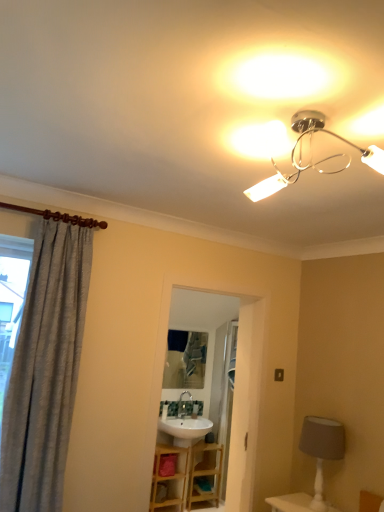
What is the approximate height of white textured table lamp at lower right?

21.40 inches.

You are a GUI agent. You are given a task and a screenshot of the screen. Output one action in this format:
    pyautogui.click(x=<x>, y=<y>)
    Task: Click on the wooden vanity at center
    
    Given the screenshot: What is the action you would take?
    pyautogui.click(x=187, y=474)

In order to face gray textured curtain at left, should I rotate leftwards or rightwards?

Rotate your view left by about 18.788°.

Locate an element on the screen. white textured table lamp at lower right is located at coordinates (322, 449).

Does wooden vanity at center have a greater width compared to gray textured curtain at left?

Indeed, wooden vanity at center has a greater width compared to gray textured curtain at left.

Between wooden vanity at center and gray textured curtain at left, which one has more height?

Standing taller between the two is gray textured curtain at left.

Is wooden vanity at center closer to the viewer compared to gray textured curtain at left?

That is False.

Is wooden vanity at center touching gray textured curtain at left?

No, wooden vanity at center is not touching gray textured curtain at left.

Could you tell me if white textured table lamp at lower right is turned towards gray textured curtain at left?

Yes.

Consider the image. Considering the sizes of objects white textured table lamp at lower right and gray textured curtain at left in the image provided, who is shorter, white textured table lamp at lower right or gray textured curtain at left?

Standing shorter between the two is white textured table lamp at lower right.

Considering the positions of objects white textured table lamp at lower right and gray textured curtain at left in the image provided, who is more to the left, white textured table lamp at lower right or gray textured curtain at left?

gray textured curtain at left is more to the left.

Considering the positions of point (317, 451) and point (17, 428), is point (317, 451) closer or farther from the camera than point (17, 428)?

Point (317, 451).

From a real-world perspective, between metallic reflective mirror at center and wooden vanity at center, who is vertically lower?

wooden vanity at center.

In the scene shown: Considering the sizes of objects metallic reflective mirror at center and wooden vanity at center in the image provided, who is shorter, metallic reflective mirror at center or wooden vanity at center?

wooden vanity at center is shorter.

Between metallic reflective mirror at center and wooden vanity at center, which one has larger size?

wooden vanity at center.

Is the position of metallic reflective mirror at center more distant than that of wooden vanity at center?

Yes, it is.

Based on the photo, can you confirm if wooden vanity at center is thinner than metallic reflective mirror at center?

No.

Considering the relative sizes of wooden vanity at center and metallic reflective mirror at center in the image provided, is wooden vanity at center taller than metallic reflective mirror at center?

No, wooden vanity at center is not taller than metallic reflective mirror at center.

Is wooden vanity at center situated inside metallic reflective mirror at center or outside?

wooden vanity at center cannot be found inside metallic reflective mirror at center.

Is gray textured curtain at left to the left of white textured table lamp at lower right from the viewer's perspective?

Yes, gray textured curtain at left is to the left of white textured table lamp at lower right.

From a real-world perspective, which is physically below, gray textured curtain at left or white textured table lamp at lower right?

white textured table lamp at lower right is physically lower.

Is gray textured curtain at left far away from white textured table lamp at lower right?

gray textured curtain at left is far away from white textured table lamp at lower right.

Choose the correct answer: Is gray textured curtain at left inside wooden vanity at center or outside it?

gray textured curtain at left is not enclosed by wooden vanity at center.

Who is more distant, gray textured curtain at left or wooden vanity at center?

wooden vanity at center.

In terms of size, does gray textured curtain at left appear bigger or smaller than wooden vanity at center?

Clearly, gray textured curtain at left is larger in size than wooden vanity at center.

From a real-world perspective, between gray textured curtain at left and wooden vanity at center, who is vertically higher?

gray textured curtain at left.

From the picture: Is white textured table lamp at lower right to the right of metallic reflective mirror at center from the viewer's perspective?

Yes, white textured table lamp at lower right is to the right of metallic reflective mirror at center.

Is point (333, 429) behind point (172, 349)?

That is False.

Is white textured table lamp at lower right smaller than metallic reflective mirror at center?

Actually, white textured table lamp at lower right might be larger than metallic reflective mirror at center.

Is white textured table lamp at lower right in front of or behind metallic reflective mirror at center in the image?

white textured table lamp at lower right is in front of metallic reflective mirror at center.

This screenshot has height=512, width=384. Identify the location of vanity behind the gray textured curtain at left. (187, 474).

Identify the location of curtain above the white textured table lamp at lower right (from the image's perspective). The image size is (384, 512). (45, 370).

Considering their positions, is white textured table lamp at lower right positioned closer to metallic reflective mirror at center than wooden vanity at center?

Based on the image, wooden vanity at center appears to be nearer to metallic reflective mirror at center.

Estimate the real-world distances between objects in this image. Which object is further from wooden vanity at center, metallic reflective mirror at center or white textured table lamp at lower right?

Based on the image, white textured table lamp at lower right appears to be further to wooden vanity at center.

From the image, which object appears to be farther from wooden vanity at center, gray textured curtain at left or metallic reflective mirror at center?

gray textured curtain at left lies further to wooden vanity at center than the other object.

When comparing their distances from wooden vanity at center, does white textured table lamp at lower right or metallic reflective mirror at center seem closer?

metallic reflective mirror at center.

Which object lies further to the anchor point metallic reflective mirror at center, gray textured curtain at left or wooden vanity at center?

The object further to metallic reflective mirror at center is gray textured curtain at left.

When comparing their distances from gray textured curtain at left, does wooden vanity at center or white textured table lamp at lower right seem closer?

white textured table lamp at lower right is closer to gray textured curtain at left.

Estimate the real-world distances between objects in this image. Which object is closer to gray textured curtain at left, metallic reflective mirror at center or wooden vanity at center?

wooden vanity at center.

From the image, which object appears to be farther from metallic reflective mirror at center, gray textured curtain at left or white textured table lamp at lower right?

The object further to metallic reflective mirror at center is gray textured curtain at left.

At what (x,y) coordinates should I click in order to perform the action: click on vanity located between gray textured curtain at left and metallic reflective mirror at center in the depth direction. Please return your answer as a coordinate pair (x, y). Looking at the image, I should click on (187, 474).

Image resolution: width=384 pixels, height=512 pixels. What are the coordinates of `table lamp between gray textured curtain at left and metallic reflective mirror at center from front to back` in the screenshot? It's located at (322, 449).

Locate an element on the screen. table lamp between gray textured curtain at left and wooden vanity at center along the z-axis is located at coordinates (322, 449).

Find the location of a particular element. Image resolution: width=384 pixels, height=512 pixels. vanity between white textured table lamp at lower right and metallic reflective mirror at center from front to back is located at coordinates (187, 474).